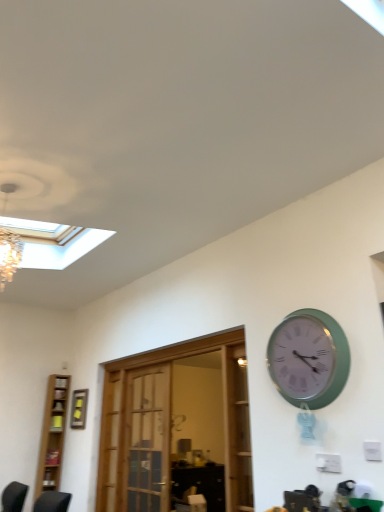
Question: Considering the relative sizes of wooden door at center and green plastic wall clock at upper right in the image provided, is wooden door at center smaller than green plastic wall clock at upper right?

Choices:
 (A) no
 (B) yes

Answer: (A)

Question: From the image's perspective, is wooden door at center on green plastic wall clock at upper right?

Choices:
 (A) no
 (B) yes

Answer: (A)

Question: Considering the relative sizes of wooden door at center and green plastic wall clock at upper right in the image provided, is wooden door at center bigger than green plastic wall clock at upper right?

Choices:
 (A) no
 (B) yes

Answer: (B)

Question: Is wooden door at center surrounding green plastic wall clock at upper right?

Choices:
 (A) yes
 (B) no

Answer: (B)

Question: Is wooden door at center to the right of green plastic wall clock at upper right from the viewer's perspective?

Choices:
 (A) yes
 (B) no

Answer: (B)

Question: Does wooden door at center have a lesser height compared to green plastic wall clock at upper right?

Choices:
 (A) no
 (B) yes

Answer: (A)

Question: Is wooden door at center positioned beyond the bounds of light brown wooden bookshelf at left?

Choices:
 (A) no
 (B) yes

Answer: (B)

Question: From the image's perspective, is wooden door at center under light brown wooden bookshelf at left?

Choices:
 (A) no
 (B) yes

Answer: (A)

Question: Is wooden door at center positioned far away from light brown wooden bookshelf at left?

Choices:
 (A) no
 (B) yes

Answer: (B)

Question: Is wooden door at center looking in the opposite direction of light brown wooden bookshelf at left?

Choices:
 (A) no
 (B) yes

Answer: (A)

Question: Does wooden door at center come in front of light brown wooden bookshelf at left?

Choices:
 (A) yes
 (B) no

Answer: (A)

Question: From a real-world perspective, is wooden door at center located beneath light brown wooden bookshelf at left?

Choices:
 (A) yes
 (B) no

Answer: (A)

Question: Considering the relative positions of yellow matte picture frame at upper left and light brown wooden bookshelf at left in the image provided, is yellow matte picture frame at upper left to the left of light brown wooden bookshelf at left from the viewer's perspective?

Choices:
 (A) no
 (B) yes

Answer: (A)